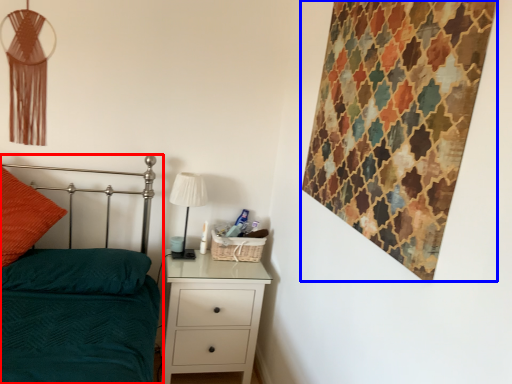
Question: Which point is further to the camera, bed (highlighted by a red box) or tapestry (highlighted by a blue box)?

Choices:
 (A) bed
 (B) tapestry

Answer: (B)